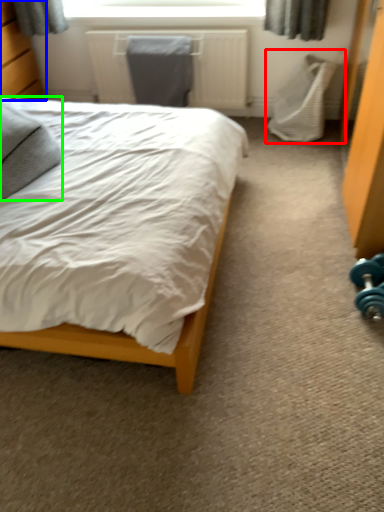
Question: Considering the real-world distances, which object is closest to swivel chair (highlighted by a red box)? dresser (highlighted by a blue box) or pillow (highlighted by a green box).

Choices:
 (A) dresser
 (B) pillow

Answer: (B)